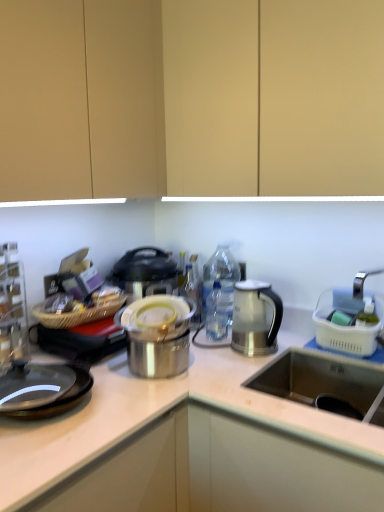
Question: From a real-world perspective, is black glass gas stove at left physically located above or below matte wood cabinet at upper center?

Choices:
 (A) above
 (B) below

Answer: (B)

Question: From the image's perspective, is black glass gas stove at left located above or below matte wood cabinet at upper center?

Choices:
 (A) above
 (B) below

Answer: (B)

Question: Which object is the closest to the satin silver kettle at center?

Choices:
 (A) clear plastic bottle at center
 (B) shiny metallic pot at center, positioned as the 2th appliance in right-to-left order
 (C) white plastic basket at right, which appears as the 2th appliance when viewed from the left
 (D) metallic glass shelf at left
 (E) matte silver pot at center

Answer: (A)

Question: Which is farther from the satin silver kettle at center?

Choices:
 (A) clear plastic bottle at center
 (B) shiny metallic pot at center, placed as the 1th appliance when sorted from left to right
 (C) white plastic basket at right, the first appliance positioned from the right
 (D) matte silver pot at center
 (E) black glass gas stove at left

Answer: (E)